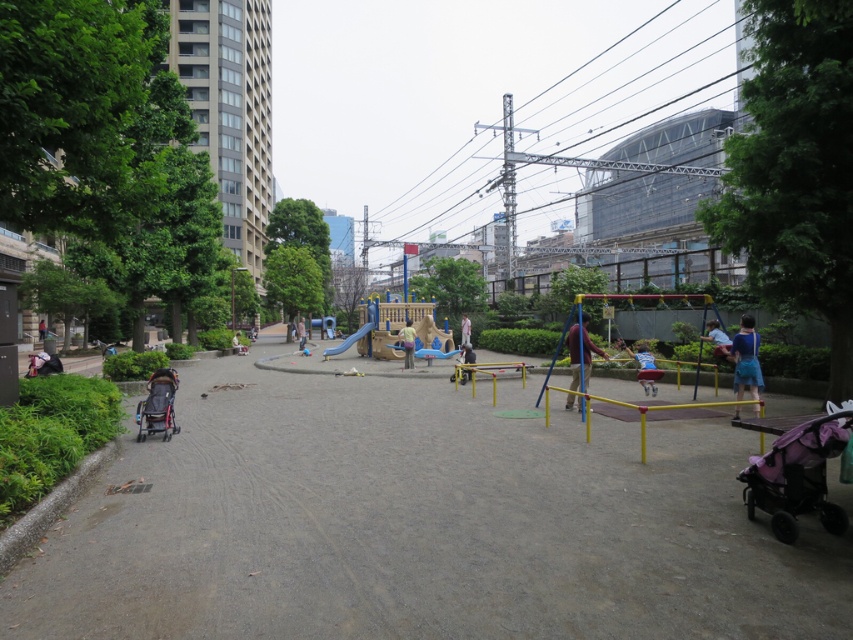
Who is higher up, blue denim shorts at right or dark blue stroller at left?

dark blue stroller at left is above.

Can you confirm if blue denim shorts at right is positioned above dark blue stroller at left?

No, blue denim shorts at right is not above dark blue stroller at left.

Is point (746, 385) behind point (39, 332)?

No.

Locate an element on the screen. blue denim shorts at right is located at coordinates (746, 358).

Who is positioned more to the right, matte purple stroller at lower right or smooth plastic slide at center?

matte purple stroller at lower right is more to the right.

Between matte purple stroller at lower right and smooth plastic slide at center, which one has more height?

smooth plastic slide at center is taller.

Is point (747, 492) positioned before point (332, 352)?

Yes, point (747, 492) is in front of point (332, 352).

I want to click on matte purple stroller at lower right, so click(x=798, y=476).

Does blue fabric swing at right have a smaller size compared to yellow plastic slide at center?

Incorrect, blue fabric swing at right is not smaller in size than yellow plastic slide at center.

Between blue fabric swing at right and yellow plastic slide at center, which one is positioned lower?

Positioned lower is yellow plastic slide at center.

Measure the distance between point (573, 372) and camera.

Point (573, 372) and camera are 44.09 feet apart.

I want to click on blue fabric swing at right, so click(579, 353).